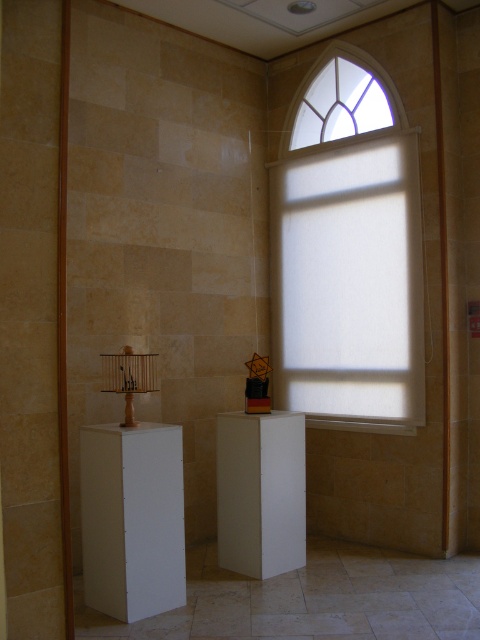
You are a delivery person who needs to place a package that is 1.5 meters long between the white matte window at upper center and the white matte pedestal at center. Can the package fit in the space between them?

The distance between the white matte window at upper center and the white matte pedestal at center is 1.23 meters. Since the package is 1.5 meters long, it cannot fit in the space between them because the package is longer than the available distance.

You are standing in the room and see two points marked in the scene. Which point is closer to you, point (359, 141) or point (276, 524)?

Point (359, 141) is further to the viewer than point (276, 524), so the closer point to you is point (276, 524).